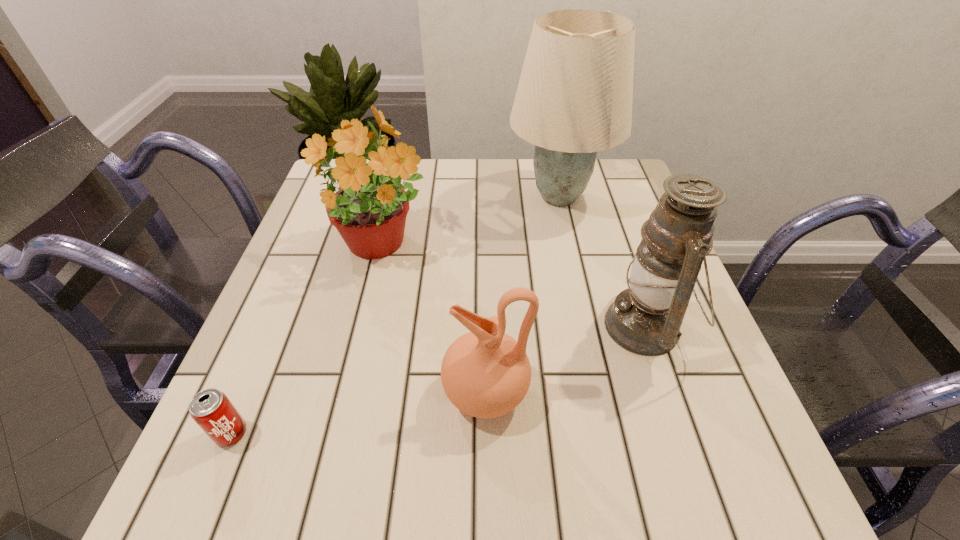
Find the location of a particular element. free space between the lampshade and the second object from left to right is located at coordinates (469, 222).

You are a GUI agent. You are given a task and a screenshot of the screen. Output one action in this format:
    pyautogui.click(x=<x>, y=<y>)
    Task: Click on the free spot between the fourth tallest object and the leftmost object
    The width and height of the screenshot is (960, 540).
    Given the screenshot: What is the action you would take?
    pyautogui.click(x=359, y=413)

Image resolution: width=960 pixels, height=540 pixels. I want to click on vacant area between the leftmost object and the tallest object, so click(x=396, y=315).

Identify the location of free space between the oil lamp and the beer can. (439, 380).

I want to click on vacant point located between the tallest object and the oil lamp, so click(x=602, y=261).

Locate an element on the screen. The height and width of the screenshot is (540, 960). blank region between the pottery and the shortest object is located at coordinates (359, 413).

The height and width of the screenshot is (540, 960). I want to click on vacant area that lies between the flowerpot and the fourth tallest object, so click(433, 320).

I want to click on unoccupied area between the oil lamp and the pottery, so click(x=565, y=359).

Where is `free area in between the oil lamp and the lampshade`? free area in between the oil lamp and the lampshade is located at coordinates (602, 261).

Select which object is the third closest to the second object from left to right. Please provide its 2D coordinates. Your answer should be formatted as a tuple, i.e. [(x, y)], where the tuple contains the x and y coordinates of a point satisfying the conditions above.

[(211, 409)]